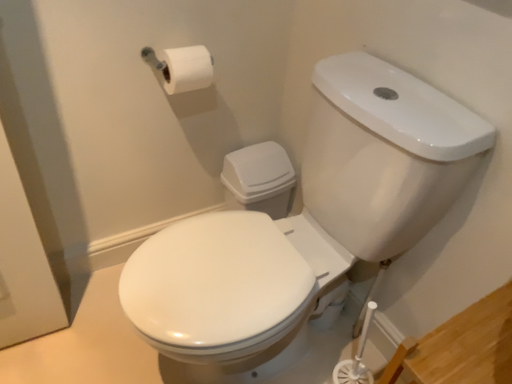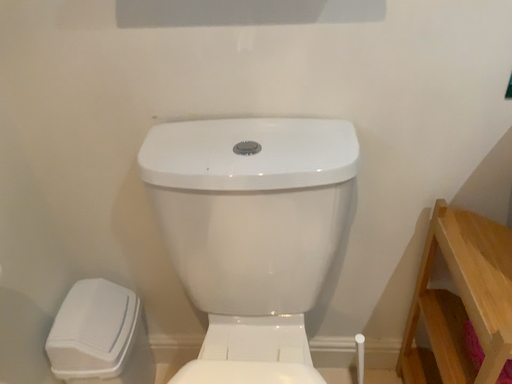
Question: How did the camera likely rotate when shooting the video?

Choices:
 (A) rotated left
 (B) rotated right

Answer: (B)